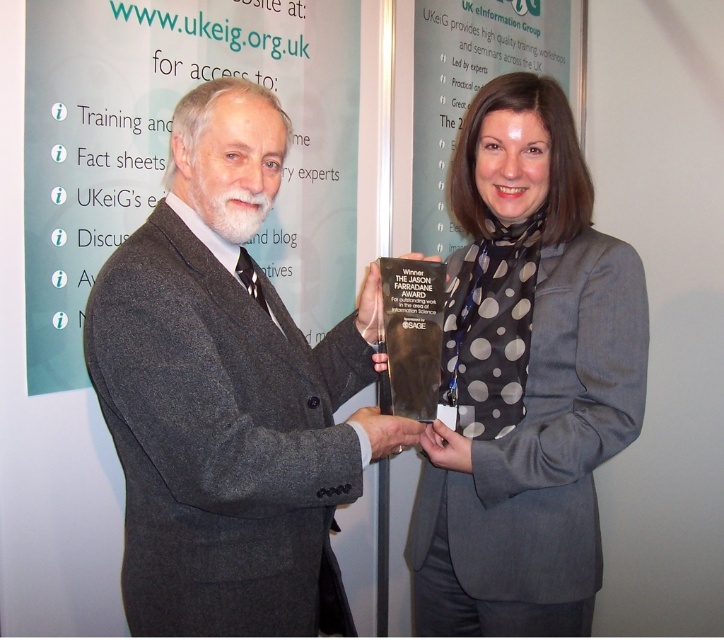
Question: Is dark gray suit at center in front of polka dot scarf at center?

Choices:
 (A) yes
 (B) no

Answer: (A)

Question: Which point is closer to the camera taking this photo?

Choices:
 (A) (589, 294)
 (B) (416, 426)

Answer: (B)

Question: Can you confirm if dark gray suit at center is smaller than polka dot scarf at center?

Choices:
 (A) yes
 (B) no

Answer: (B)

Question: Which of the following is the farthest from the observer?

Choices:
 (A) polka dot scarf at center
 (B) dark gray suit at center

Answer: (A)

Question: Is dark gray suit at center below polka dot scarf at center?

Choices:
 (A) no
 (B) yes

Answer: (A)